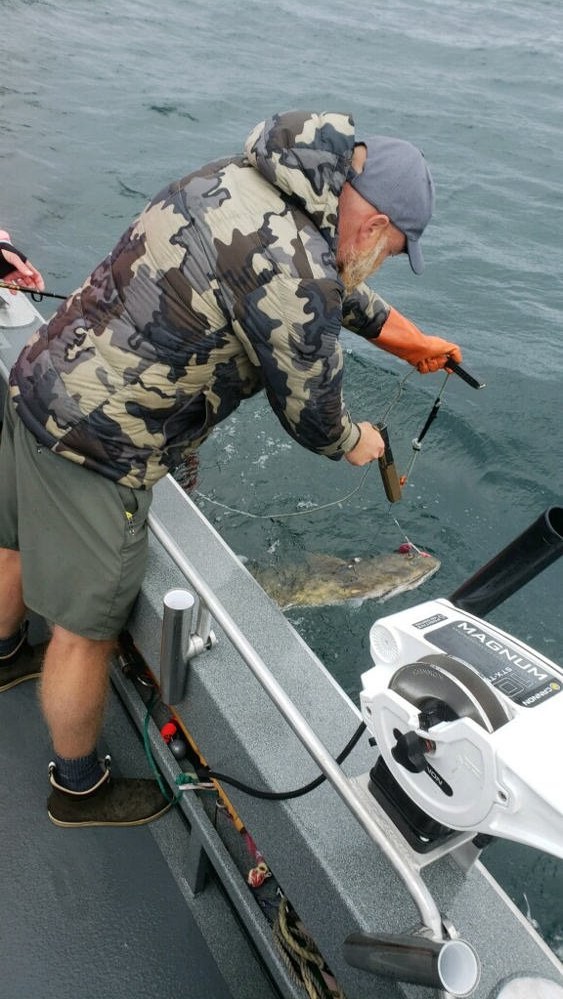
Where is `handle`? The height and width of the screenshot is (999, 563). handle is located at coordinates (464, 372).